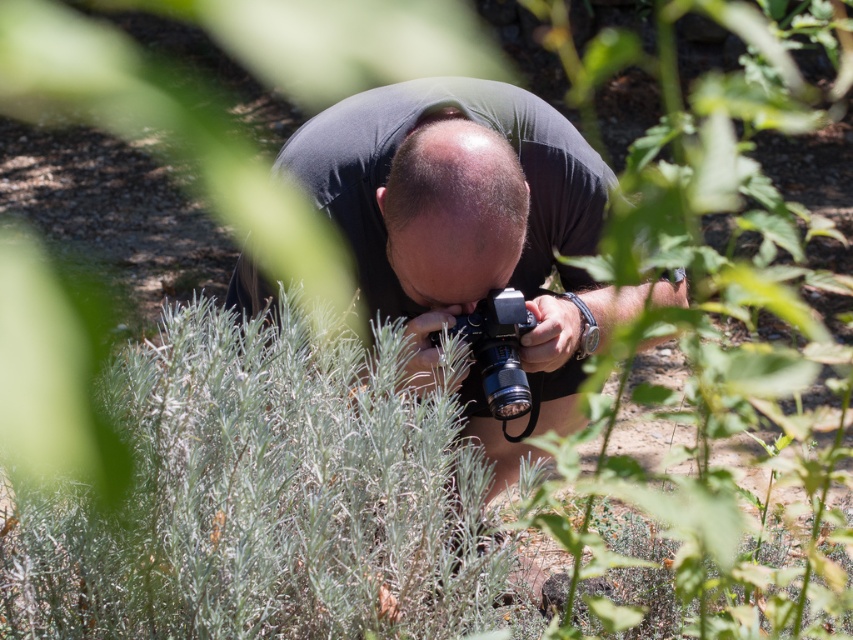
Question: Is black matte camera at center positioned behind black plastic camera at center?

Choices:
 (A) no
 (B) yes

Answer: (A)

Question: Which of the following is the farthest from the observer?

Choices:
 (A) black plastic camera at center
 (B) black matte camera at center

Answer: (A)

Question: Can you confirm if black matte camera at center is smaller than black plastic camera at center?

Choices:
 (A) no
 (B) yes

Answer: (A)

Question: Among these points, which one is farthest from the camera?

Choices:
 (A) [x=503, y=416]
 (B) [x=548, y=356]

Answer: (B)

Question: Observing the image, what is the correct spatial positioning of black matte camera at center in reference to black plastic camera at center?

Choices:
 (A) below
 (B) above

Answer: (B)